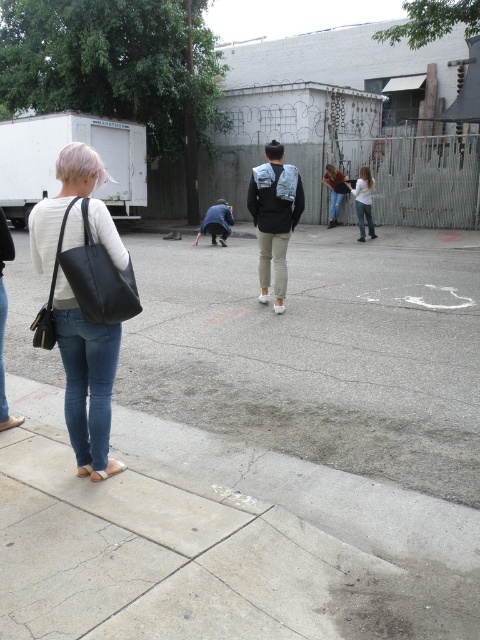
Question: Which of these objects is positioned closest to the blue denim jacket at center?

Choices:
 (A) white matte shirt at center
 (B) gray concrete pavement at center
 (C) matte black tote bag at left

Answer: (A)

Question: Is white matte shirt at center positioned in front of denim jacket at center?

Choices:
 (A) no
 (B) yes

Answer: (B)

Question: Considering the relative positions of blue denim jacket at center and denim jacket at center in the image provided, where is blue denim jacket at center located with respect to denim jacket at center?

Choices:
 (A) right
 (B) left

Answer: (B)

Question: Where is matte black tote bag at left located in relation to white matte shirt at center in the image?

Choices:
 (A) below
 (B) above

Answer: (A)

Question: Which point appears farthest from the camera in this image?

Choices:
 (A) (211, 232)
 (B) (260, 198)

Answer: (A)

Question: Which point appears farthest from the camera in this image?

Choices:
 (A) (300, 198)
 (B) (173, 294)
 (C) (362, 188)

Answer: (C)